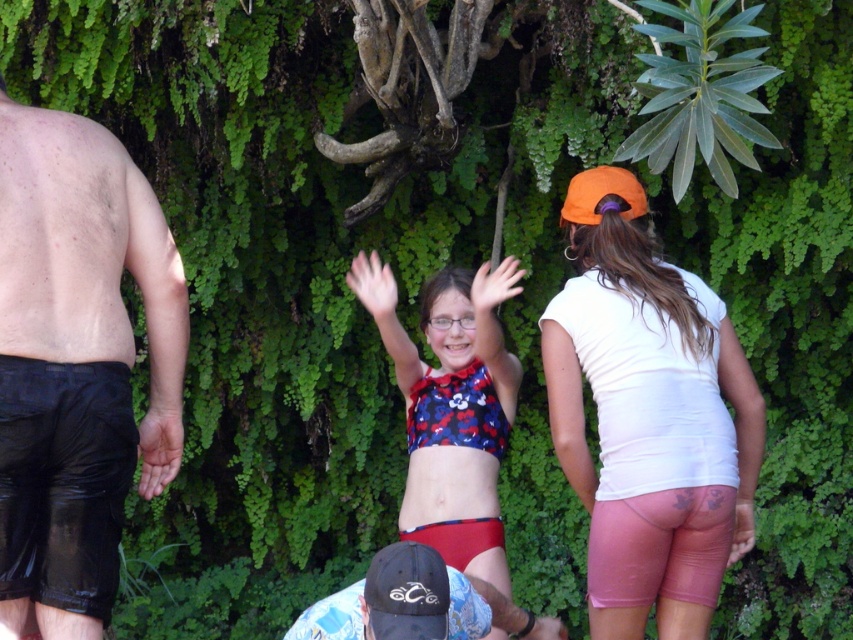
How much distance is there between black wet shorts at left and black cap at lower center?

The distance of black wet shorts at left from black cap at lower center is 36.19 inches.

Can you confirm if black wet shorts at left is wider than black cap at lower center?

Incorrect, black wet shorts at left's width does not surpass black cap at lower center's.

Find the location of a particular element. Image resolution: width=853 pixels, height=640 pixels. black wet shorts at left is located at coordinates (77, 364).

Who is higher up, black wet shorts at left or white matte shorts at right?

black wet shorts at left

Between point (41, 205) and point (704, 520), which one is positioned behind?

The point (704, 520) is behind.

This screenshot has width=853, height=640. Describe the element at coordinates (77, 364) in the screenshot. I see `black wet shorts at left` at that location.

Find the location of a particular element. The image size is (853, 640). black wet shorts at left is located at coordinates (77, 364).

Does point (21, 236) come farther from viewer compared to point (479, 275)?

No.

Between black wet shorts at left and blue floral bikini top at center, which one is positioned higher?

Positioned higher is black wet shorts at left.

Does point (111, 193) lie behind point (474, 289)?

That is False.

The width and height of the screenshot is (853, 640). I want to click on black wet shorts at left, so click(77, 364).